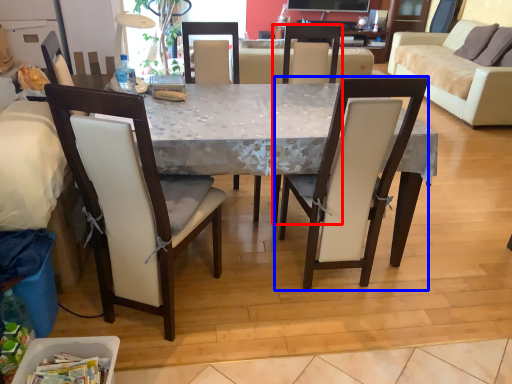
Question: Which of the following is the farthest to the observer, chair (highlighted by a red box) or chair (highlighted by a blue box)?

Choices:
 (A) chair
 (B) chair

Answer: (A)